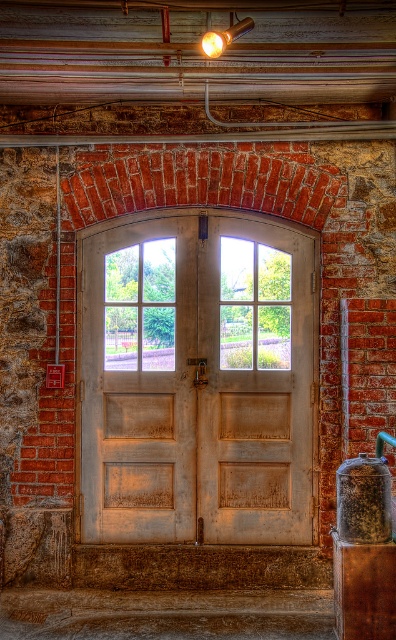
Question: Which object is the closest to the clear glass window at center?

Choices:
 (A) white wood door at center
 (B) brown textured pillar at lower right
 (C) matte gold light fixture at upper center

Answer: (A)

Question: Does clear glass window at center have a greater width compared to matte gold light fixture at upper center?

Choices:
 (A) yes
 (B) no

Answer: (A)

Question: Which of the following is the closest to the observer?

Choices:
 (A) white wood door at center
 (B) clear glass window at center
 (C) brown textured pillar at lower right
 (D) matte gold light fixture at upper center

Answer: (D)

Question: Does clear glass window at center have a smaller size compared to brown textured pillar at lower right?

Choices:
 (A) no
 (B) yes

Answer: (B)

Question: Does white wood door at center have a lesser width compared to clear glass window at center?

Choices:
 (A) yes
 (B) no

Answer: (B)

Question: Based on their relative distances, which object is nearer to the clear glass window at center?

Choices:
 (A) matte gold light fixture at upper center
 (B) brown textured pillar at lower right
 (C) white wood door at center

Answer: (C)